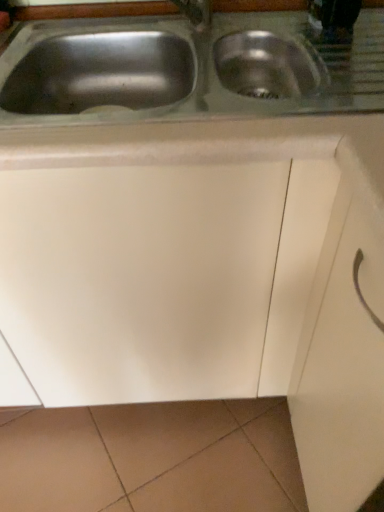
Question: Would you say white matte drawer at center is to the left or to the right of stainless steel sink at center in the picture?

Choices:
 (A) left
 (B) right

Answer: (B)

Question: Is white matte drawer at center in front of or behind stainless steel sink at center in the image?

Choices:
 (A) front
 (B) behind

Answer: (A)

Question: From the image's perspective, is white matte drawer at center located above or below stainless steel sink at center?

Choices:
 (A) above
 (B) below

Answer: (B)

Question: Is point (96, 109) positioned closer to the camera than point (332, 318)?

Choices:
 (A) farther
 (B) closer

Answer: (A)

Question: Is stainless steel sink at center wider or thinner than white matte drawer at center?

Choices:
 (A) thin
 (B) wide

Answer: (B)

Question: Considering the positions of stainless steel sink at center and white matte drawer at center in the image, is stainless steel sink at center bigger or smaller than white matte drawer at center?

Choices:
 (A) big
 (B) small

Answer: (A)

Question: Is stainless steel sink at center spatially inside white matte drawer at center, or outside of it?

Choices:
 (A) inside
 (B) outside

Answer: (B)